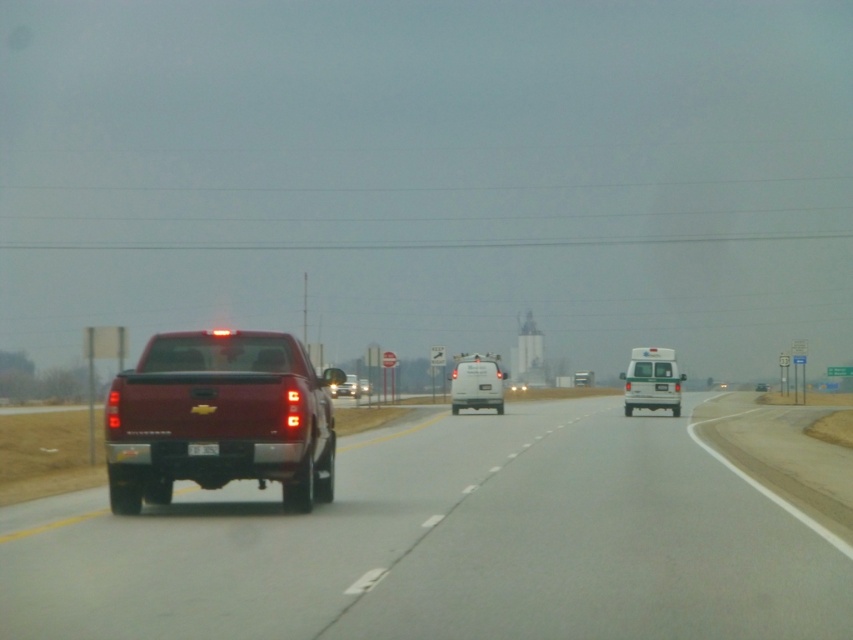
You are driving a car that requires a 20 meter distance to safely pass between two vehicles. Based on the scene, can you safely pass between the white matte van at center and the metallic red truck at center?

The distance between the white matte van at center and the metallic red truck at center is 25.10 meters, which is more than the required 20 meters. Therefore, you can safely pass between them.

You are a delivery driver who needs to switch lanes to pass the slower vehicle ahead. Given that your vehicle is 2.5 meters wide, can you safely move into the lane where the white glossy van at center and the metallic red truck at center are traveling?

The white glossy van at center is narrower than the metallic red truck at center. However, since the question involves lane width and vehicle dimensions, the provided information does not specify the width of the lane itself or the spacing between vehicles. Therefore, it is not possible to determine if the maneuver is safe based solely on the given data.